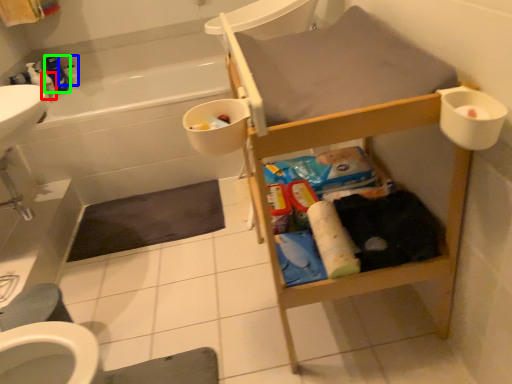
Question: Considering the real-world distances, which object is closest to toiletry (highlighted by a red box)? toiletry (highlighted by a blue box) or cleaning product (highlighted by a green box).

Choices:
 (A) toiletry
 (B) cleaning product

Answer: (B)